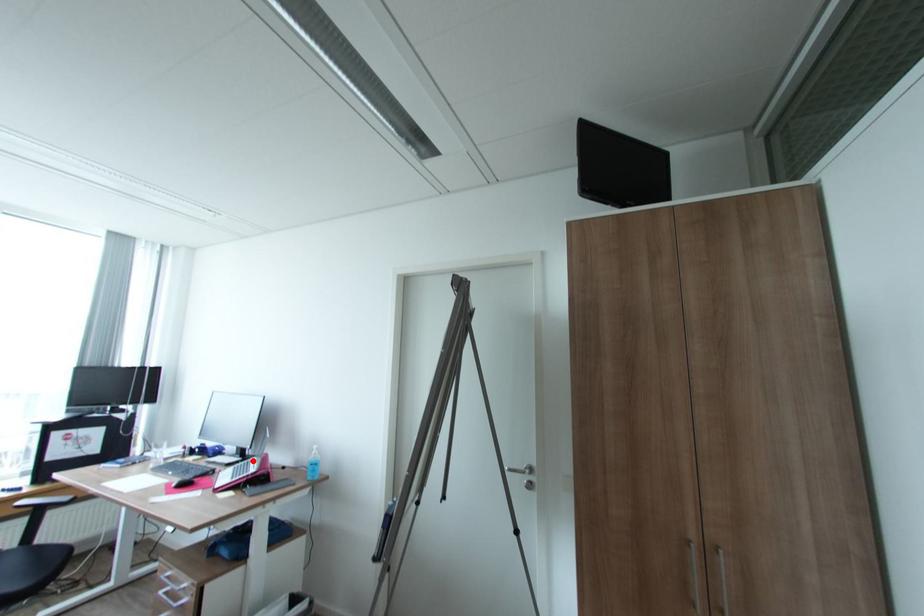
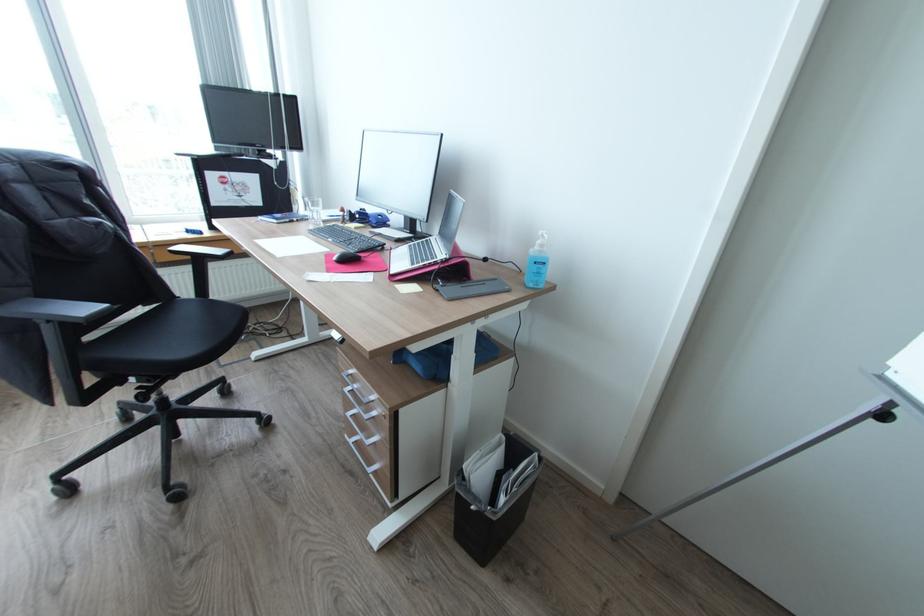
Locate, in the second image, the point that corresponds to the highlighted location in the first image.

(432, 238)